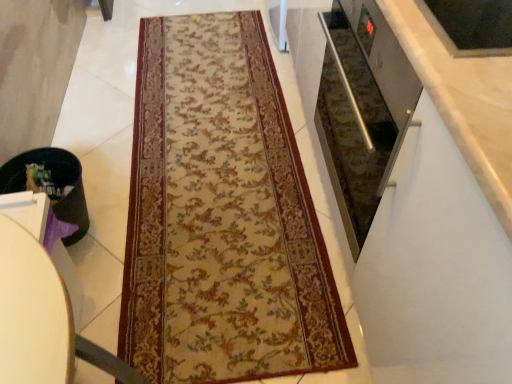
Question: Is the position of black plastic trash can at lower left less distant than that of beige floral rug at center?

Choices:
 (A) no
 (B) yes

Answer: (A)

Question: Is black plastic trash can at lower left not inside beige floral rug at center?

Choices:
 (A) no
 (B) yes

Answer: (B)

Question: Is black plastic trash can at lower left next to beige floral rug at center and touching it?

Choices:
 (A) yes
 (B) no

Answer: (B)

Question: Considering the relative sizes of black plastic trash can at lower left and beige floral rug at center in the image provided, is black plastic trash can at lower left smaller than beige floral rug at center?

Choices:
 (A) yes
 (B) no

Answer: (A)

Question: Could you tell me if black plastic trash can at lower left is turned towards beige floral rug at center?

Choices:
 (A) yes
 (B) no

Answer: (B)

Question: Is black plastic trash can at lower left inside the boundaries of black plastic trash can at lower left, or outside?

Choices:
 (A) outside
 (B) inside

Answer: (A)

Question: Relative to black plastic trash can at lower left, is black plastic trash can at lower left in front or behind?

Choices:
 (A) behind
 (B) front

Answer: (B)

Question: Based on their positions, is black plastic trash can at lower left located to the left or right of black plastic trash can at lower left?

Choices:
 (A) left
 (B) right

Answer: (B)

Question: Considering the positions of black plastic trash can at lower left and black plastic trash can at lower left in the image, is black plastic trash can at lower left wider or thinner than black plastic trash can at lower left?

Choices:
 (A) thin
 (B) wide

Answer: (A)

Question: Is black plastic trash can at lower left inside or outside of black plastic trash can at lower left?

Choices:
 (A) outside
 (B) inside

Answer: (A)

Question: Is black plastic trash can at lower left taller or shorter than black plastic trash can at lower left?

Choices:
 (A) short
 (B) tall

Answer: (A)

Question: Considering their positions, is black plastic trash can at lower left located in front of or behind black plastic trash can at lower left?

Choices:
 (A) behind
 (B) front

Answer: (A)

Question: Is point (6, 183) positioned closer to the camera than point (34, 261)?

Choices:
 (A) farther
 (B) closer

Answer: (A)

Question: Considering the positions of black plastic trash can at lower left and beige floral rug at center in the image, is black plastic trash can at lower left taller or shorter than beige floral rug at center?

Choices:
 (A) tall
 (B) short

Answer: (A)

Question: Is black plastic trash can at lower left in front of or behind beige floral rug at center in the image?

Choices:
 (A) behind
 (B) front

Answer: (B)